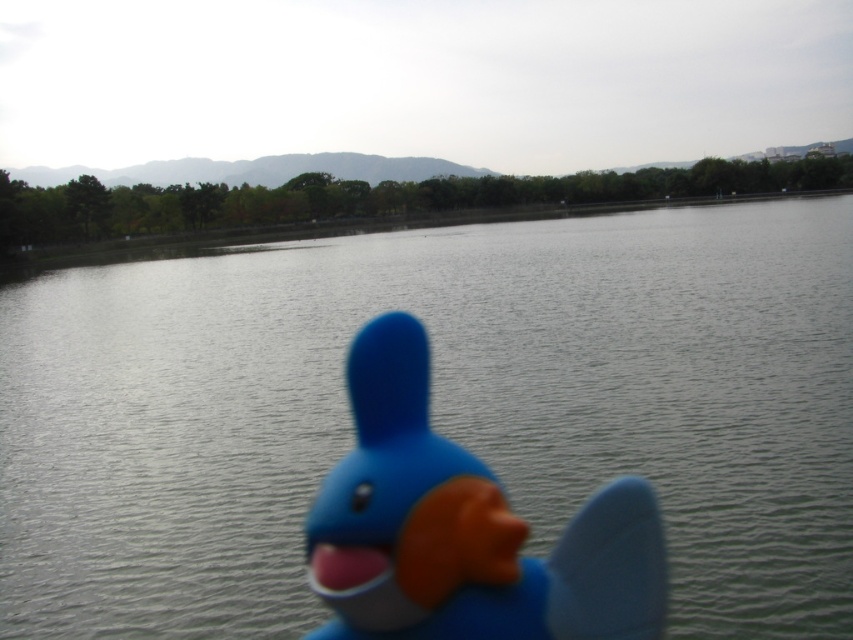
You are standing at the origin point in this outdoor scene. There are two points marked in the image. Which point is closer to you, point [799,324] or point [357,636]?

Point [357,636] is closer to you because it is in front of point [799,324].